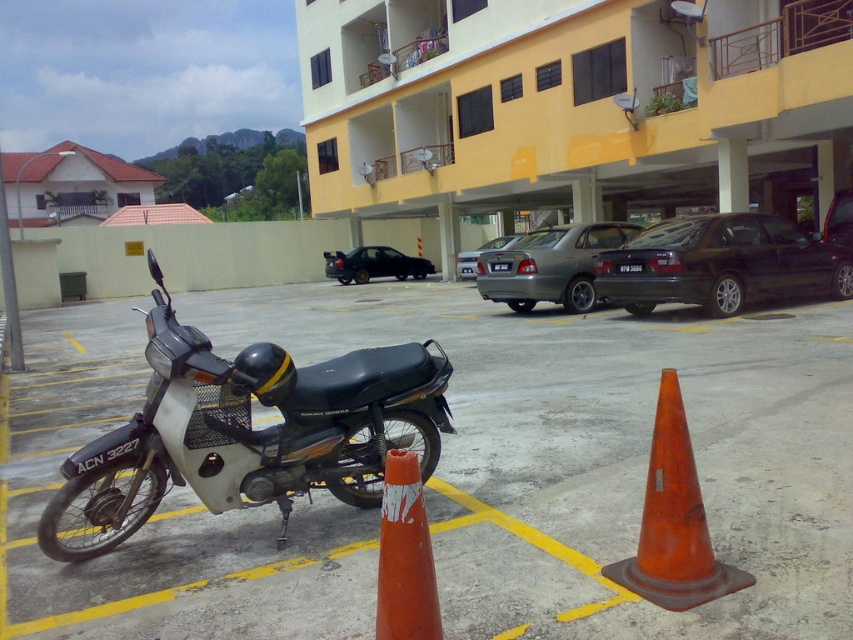
You are driving a car and want to park in the parking area near the light yellow building. You see a black metallic car at right and a silver metallic sedan at center. Which parking spot is closer to the building between the two cars?

The silver metallic sedan at center is closer to the building because the black metallic car at right is to the right of it, meaning the sedan is positioned more towards the center near the building.

You are standing at the entrance of the parking area and need to locate the black metallic car at right. According to the coordinates provided, where should you look to find it?

The black metallic car at right is located at the 2D coordinates point (720, 264), so you should look towards the right side of the parking area where those coordinates are mapped.